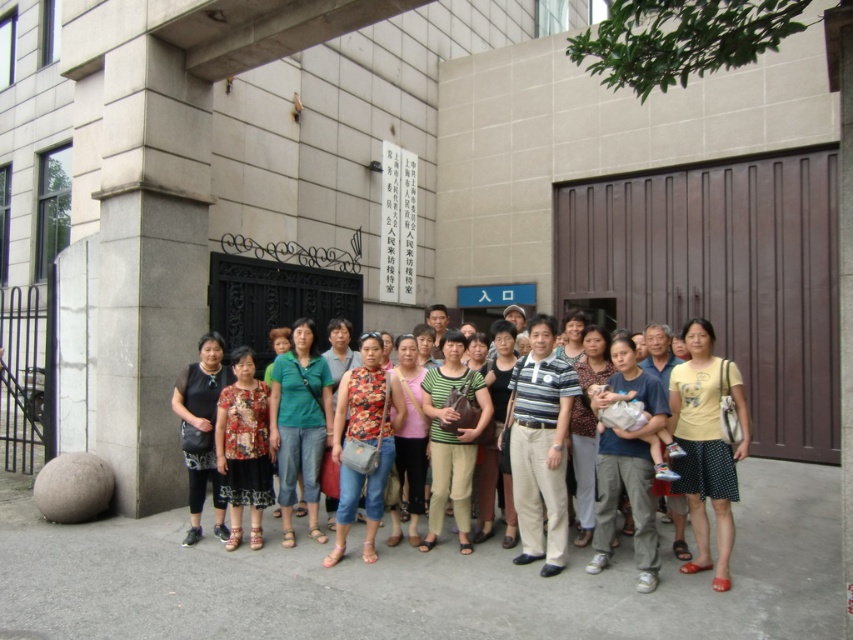
You are a photographer trying to capture a clear shot of the yellow cotton shirt at center and the green matte shirt at center. Which one is covering part of the other?

The yellow cotton shirt at center is positioned over green matte shirt at center, so it is covering part of it.

Looking at this image, you are part of the group in the photo and need to identify who is closer to the camera. Which person is positioned in front between the yellow cotton shirt at center and the matte black top at center?

The yellow cotton shirt at center is in front of the matte black top at center, so the person wearing the yellow cotton shirt at center is closer to the camera.

What is the color of the fabric tank top at point (364, 442)?

The printed fabric tank top at center is blue.